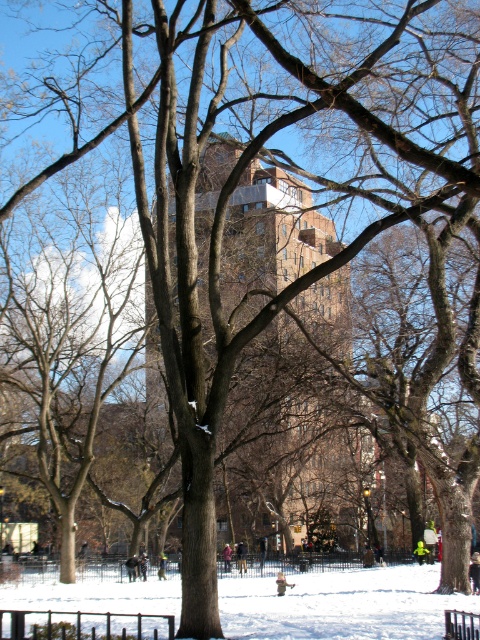
What are the coordinates of `white powdery snow at center` in the screenshot? It's located at (340, 604).

Between white powdery snow at center and black metal bench at center, which one has less height?

Standing shorter between the two is black metal bench at center.

Who is more distant from viewer, (46, 586) or (453, 632)?

The point (46, 586) is more distant.

Find the location of a particular element. The height and width of the screenshot is (640, 480). white powdery snow at center is located at coordinates (340, 604).

In the scene shown: Which is above, brown brick building at center or white powdery snow at center?

brown brick building at center

What do you see at coordinates (251, 243) in the screenshot? The width and height of the screenshot is (480, 640). I see `brown brick building at center` at bounding box center [251, 243].

I want to click on brown brick building at center, so click(x=251, y=243).

Where is `brown brick building at center`? brown brick building at center is located at coordinates (251, 243).

Can you confirm if brown brick building at center is smaller than black metal bench at center?

No.

Is point (204, 369) in front of point (472, 614)?

No, (204, 369) is behind (472, 614).

Locate an element on the screen. This screenshot has height=640, width=480. brown brick building at center is located at coordinates (251, 243).